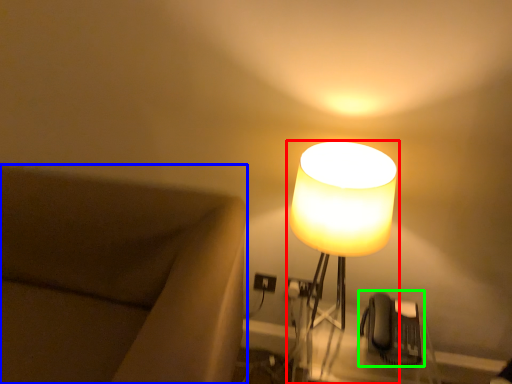
Question: Which is farther away from lamp (highlighted by a red box)? furniture (highlighted by a blue box) or swivel chair (highlighted by a green box)?

Choices:
 (A) furniture
 (B) swivel chair

Answer: (A)